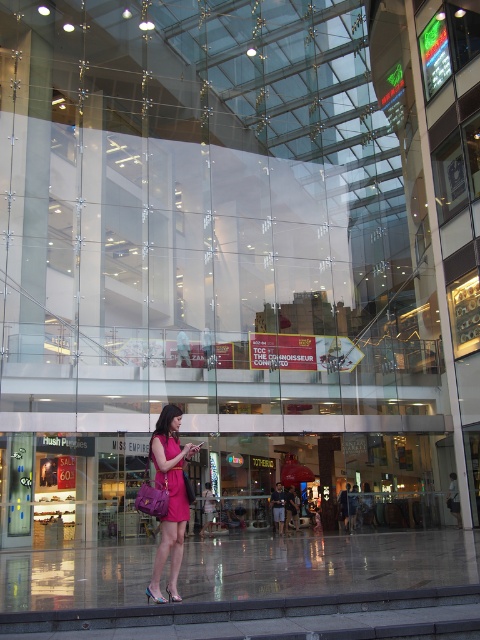
Can you confirm if pink fabric dress at center is wider than matte pink dress at center?

Yes, pink fabric dress at center is wider than matte pink dress at center.

Can you confirm if pink fabric dress at center is positioned above matte pink dress at center?

No.

Where is `pink fabric dress at center`? The height and width of the screenshot is (640, 480). pink fabric dress at center is located at coordinates point(169,497).